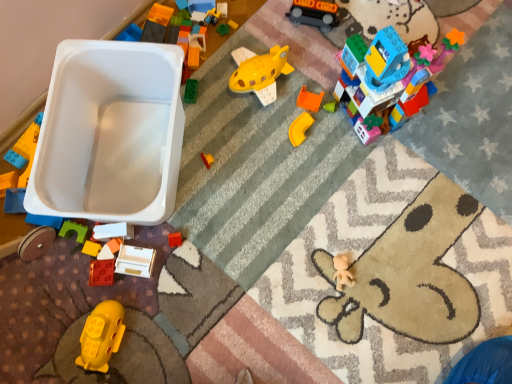
Locate an element on the screen. This screenshot has height=384, width=512. vacant region to the right of white matte block at lower left, arranged as the fifth toy when ordered from the bottom is located at coordinates (182, 238).